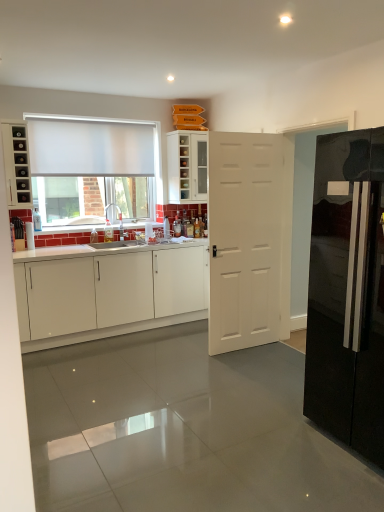
Question: Is glossy black refrigerator at right positioned in front of white glossy cabinet at upper center, which is counted as the third cabinetry, starting from the bottom?

Choices:
 (A) no
 (B) yes

Answer: (B)

Question: Does glossy black refrigerator at right turn towards white glossy cabinet at upper center, which is counted as the third cabinetry, starting from the bottom?

Choices:
 (A) yes
 (B) no

Answer: (B)

Question: Is glossy black refrigerator at right directly adjacent to white glossy cabinet at upper center, which is counted as the third cabinetry, starting from the bottom?

Choices:
 (A) yes
 (B) no

Answer: (B)

Question: Can you confirm if glossy black refrigerator at right is positioned to the left of white glossy cabinet at upper center, which is counted as the third cabinetry, starting from the bottom?

Choices:
 (A) yes
 (B) no

Answer: (B)

Question: From a real-world perspective, does glossy black refrigerator at right sit lower than white glossy cabinet at upper center, which ranks as the 1th cabinetry in top-to-bottom order?

Choices:
 (A) yes
 (B) no

Answer: (A)

Question: Is glossy black refrigerator at right at the right side of white glossy cabinet at upper center, which ranks as the 1th cabinetry in top-to-bottom order?

Choices:
 (A) no
 (B) yes

Answer: (B)

Question: Are white matte curtain at upper left and matte black cabinet at left, which ranks as the second cabinetry in bottom-to-top order, beside each other?

Choices:
 (A) yes
 (B) no

Answer: (B)

Question: Would you say white matte curtain at upper left contains matte black cabinet at left, which ranks as the second cabinetry in bottom-to-top order?

Choices:
 (A) no
 (B) yes

Answer: (A)

Question: From the image's perspective, is white matte curtain at upper left located beneath matte black cabinet at left, the second cabinetry from the top?

Choices:
 (A) no
 (B) yes

Answer: (A)

Question: Is white matte curtain at upper left facing towards matte black cabinet at left, the second cabinetry from the top?

Choices:
 (A) no
 (B) yes

Answer: (A)

Question: Is white matte curtain at upper left smaller than matte black cabinet at left, which ranks as the second cabinetry in bottom-to-top order?

Choices:
 (A) no
 (B) yes

Answer: (A)

Question: Is white matte curtain at upper left outside of matte black cabinet at left, the second cabinetry from the top?

Choices:
 (A) yes
 (B) no

Answer: (A)

Question: Is white glossy cabinet at upper center, which is counted as the third cabinetry, starting from the bottom, thinner than white matte door at center?

Choices:
 (A) yes
 (B) no

Answer: (B)